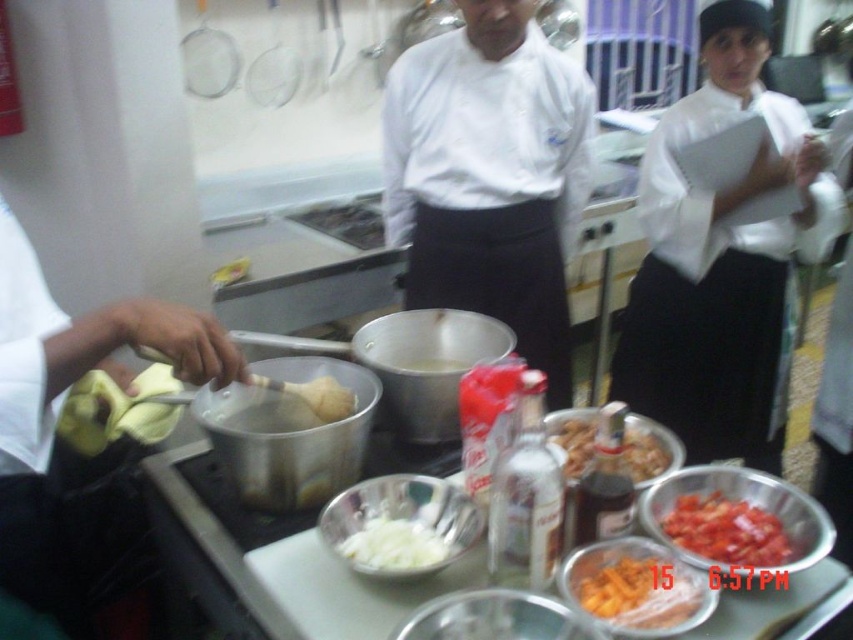
Question: Which of the following is the closest to the observer?

Choices:
 (A) shiny metallic bowl at center
 (B) white creamy substance at center

Answer: (A)

Question: Considering the real-world distances, which object is farthest from the shiny metallic bowl at center?

Choices:
 (A) white matte liquid at center
 (B) chopped red pepper at center
 (C) orange matte carrot at lower center

Answer: (A)

Question: Does white creamy substance at center appear over white matte liquid at center?

Choices:
 (A) no
 (B) yes

Answer: (A)

Question: Which object is farther from the camera taking this photo?

Choices:
 (A) shiny metallic bowl at center
 (B) white glossy chef coat at center
 (C) orange matte carrot at lower center

Answer: (B)

Question: Does white glossy chef coat at center come behind chopped red pepper at center?

Choices:
 (A) no
 (B) yes

Answer: (B)

Question: Is white paper at right in front of white creamy onions at center?

Choices:
 (A) no
 (B) yes

Answer: (A)